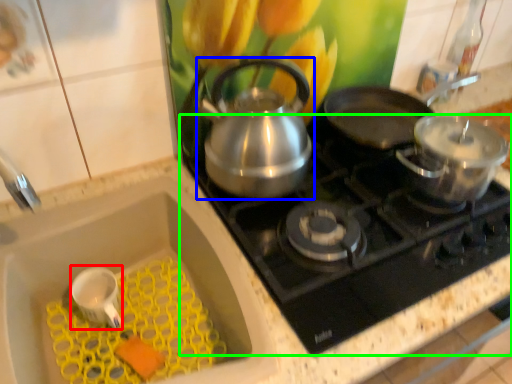
Question: Estimate the real-world distances between objects in this image. Which object is closer to appliance (highlighted by a red box), kettle (highlighted by a blue box) or gas stove (highlighted by a green box)?

Choices:
 (A) kettle
 (B) gas stove

Answer: (A)